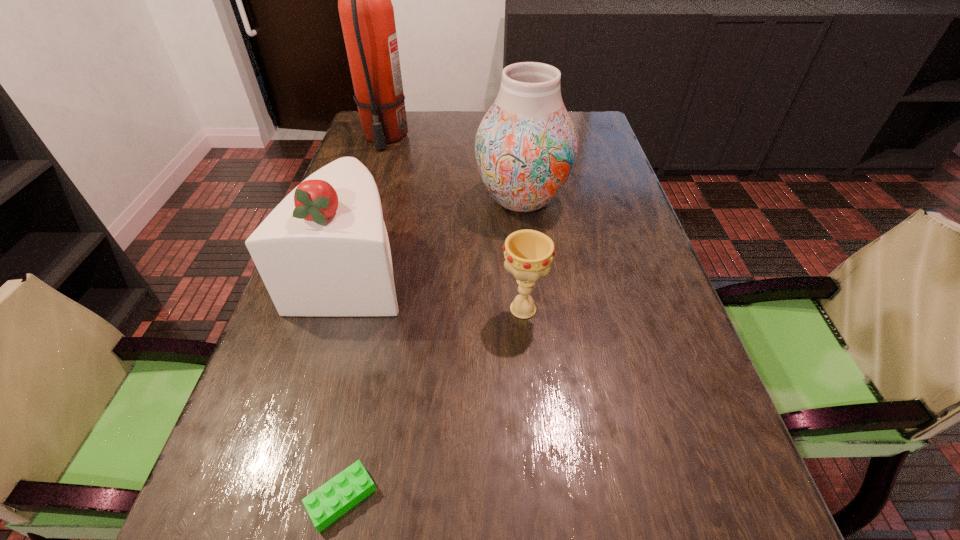
The height and width of the screenshot is (540, 960). I want to click on object that is the nearest to the second shortest object, so click(x=324, y=251).

The image size is (960, 540). In order to click on free region that satisfies the following two spatial constraints: 1. on the nozzle of the fire extinguisher; 2. on the left side of the third tallest object in this screenshot , I will do `click(343, 268)`.

Identify the location of free space that satisfies the following two spatial constraints: 1. on the nozzle of the fire extinguisher; 2. on the right side of the Lego. (270, 497).

The image size is (960, 540). Identify the location of vacant space that satisfies the following two spatial constraints: 1. on the back side of the Lego; 2. on the right side of the second shortest object. point(381,309).

The height and width of the screenshot is (540, 960). What are the coordinates of `free space that satisfies the following two spatial constraints: 1. on the nozzle of the tallest object; 2. on the right side of the cake` in the screenshot? It's located at (343, 268).